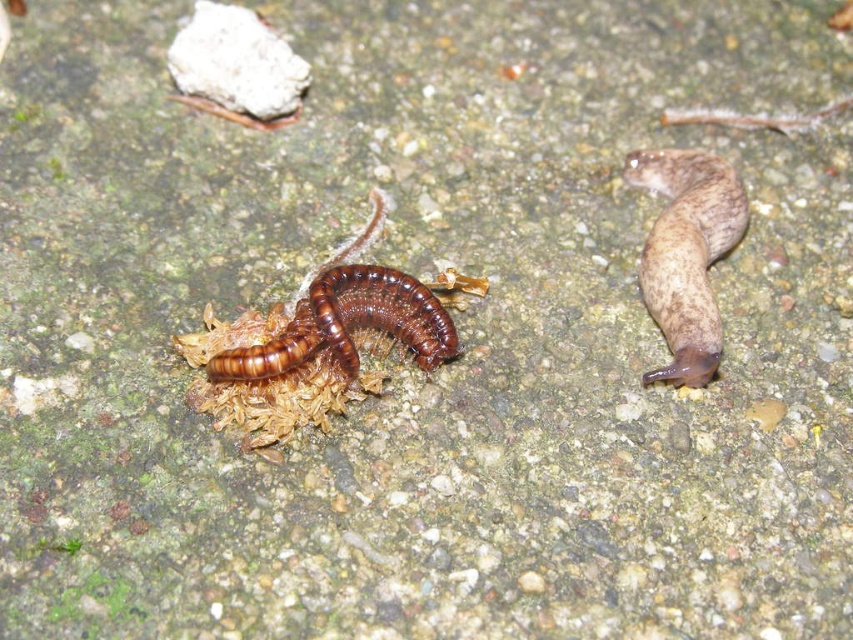
You are a gardener who needs to place a 12 inch ruler between the brown rubbery snail at right and the brown shiny centipede at center. Can the ruler fit between them without overlapping either creature?

The brown rubbery snail at right is 16.64 inches from the brown shiny centipede at center. Since the ruler is 12 inches long, it can fit between them without overlapping either creature as the distance is greater than the ruler length.

You are a gardener examining the damp ground. You notice the brown rubbery snail at right and the brown shiny centipede at center. Which creature is located above the other?

Answer: The brown rubbery snail at right is positioned over the brown shiny centipede at center.

You are a biologist observing the damp ground. You notice a brown rubbery snail at right and a brown shiny centipede at center. Which creature has a greater height?

The brown rubbery snail at right is much taller than the brown shiny centipede at center.